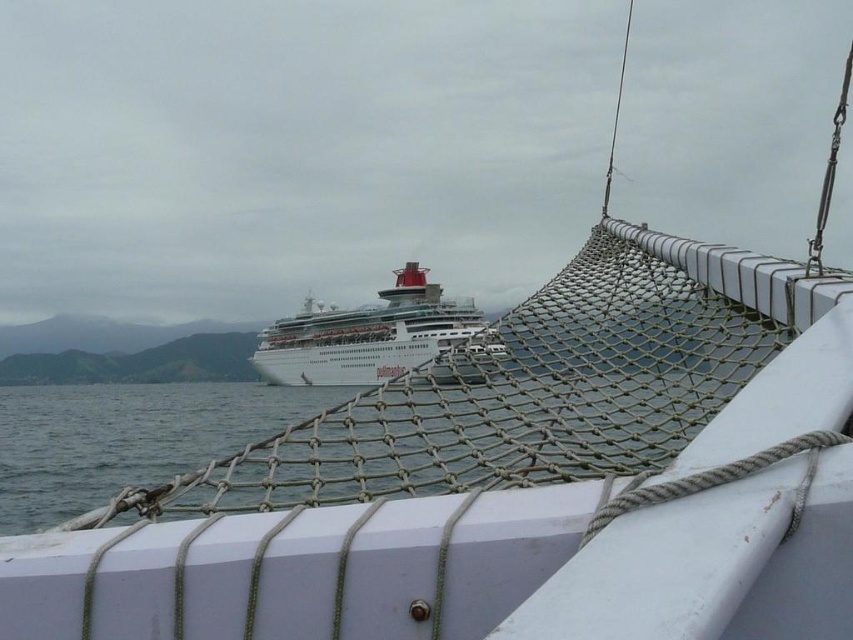
You are on the deck of the smaller vessel and want to know the position of the clear water at center relative to the white glossy cruise ship at center. Which one is lower in the scene?

The clear water at center is below the white glossy cruise ship at center, so the clear water at center is lower in the scene.

You are standing on the deck of the smaller vessel and want to locate the clear water at center. According to the coordinates provided, where should you look relative to your current position?

The clear water at center is located at coordinates point [129,420], which means it is positioned to the right and slightly above your current position on the deck.